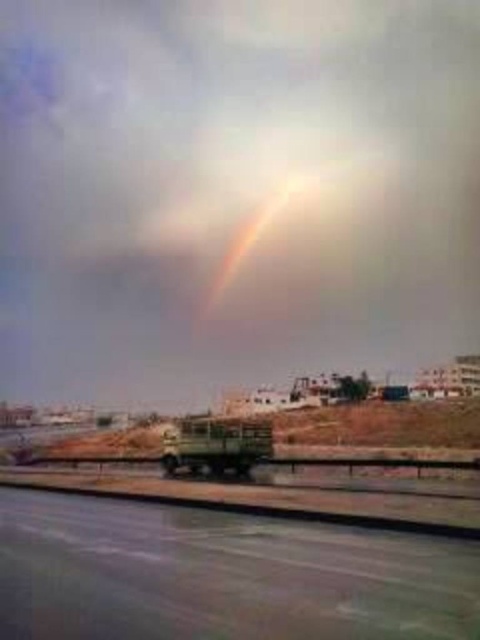
Based on the scene description, which object has a greater width between the rainbow translucent cloud at upper center and the smooth asphalt highway at lower center?

The rainbow translucent cloud at upper center has a greater width than the smooth asphalt highway at lower center according to the description.

You are a photographer standing on the road and want to capture both the rainbow translucent cloud at upper center and the rainbow at center in a single shot. Given that your camera has a maximum zoom range of 100 meters, can you fit both objects into the frame without moving?

The distance between the rainbow translucent cloud at upper center and the rainbow at center is 125.41 meters. Since your camera can only zoom up to 100 meters, you cannot fit both objects into the frame without moving closer or adjusting your position.